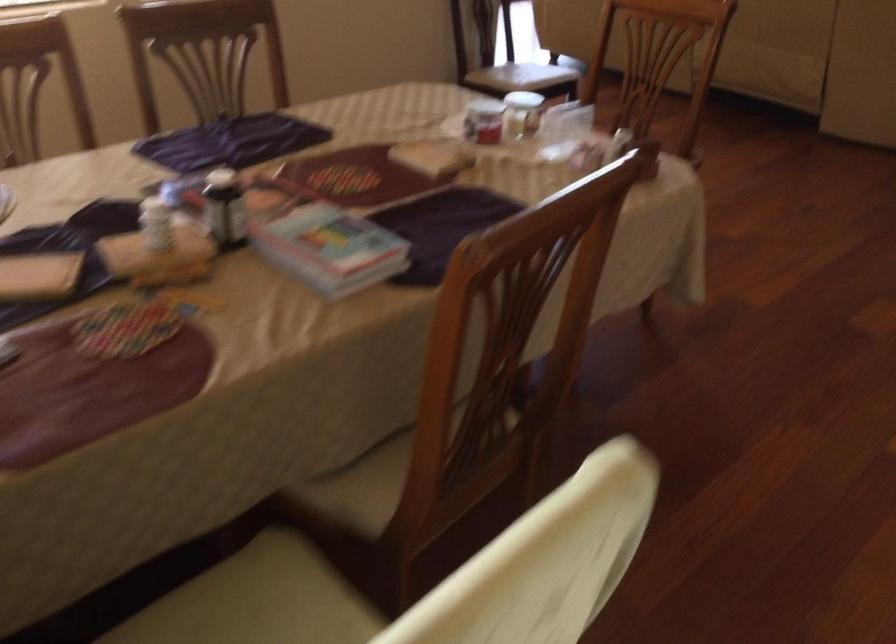
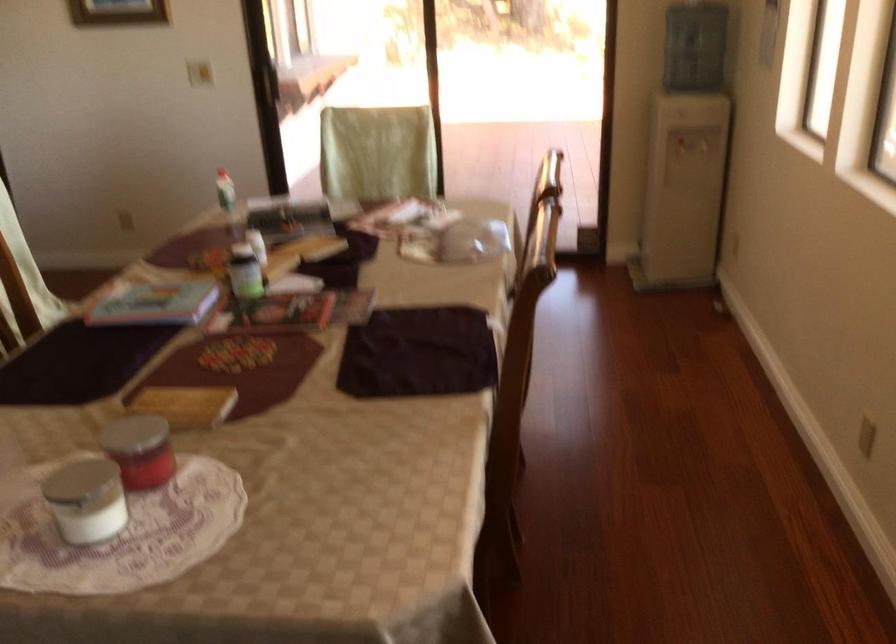
Where in the second image is the point corresponding to (225,207) from the first image?

(245, 272)